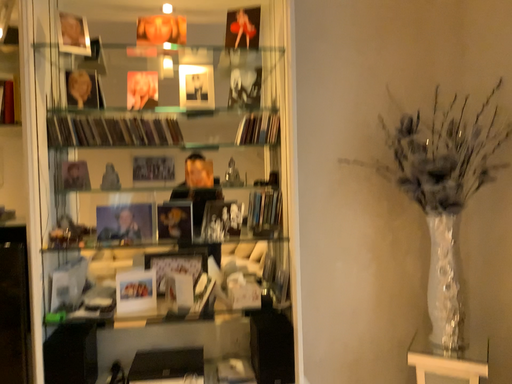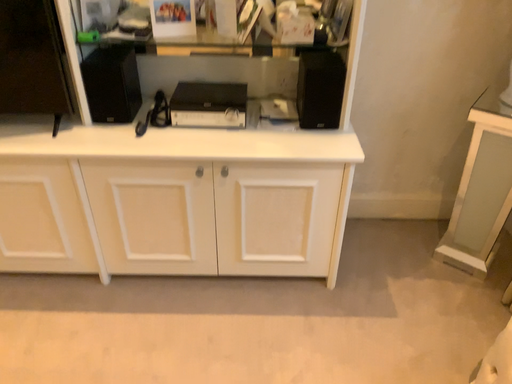
Question: Which way did the camera rotate in the video?

Choices:
 (A) rotated left
 (B) rotated right

Answer: (A)